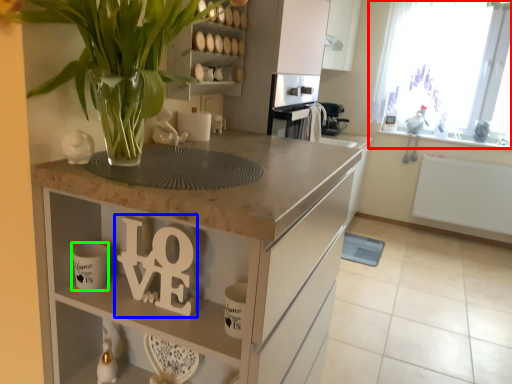
Question: Estimate the real-world distances between objects in this image. Which object is closer to window (highlighted by a red box), alphabet (highlighted by a blue box) or mug (highlighted by a green box)?

Choices:
 (A) alphabet
 (B) mug

Answer: (A)